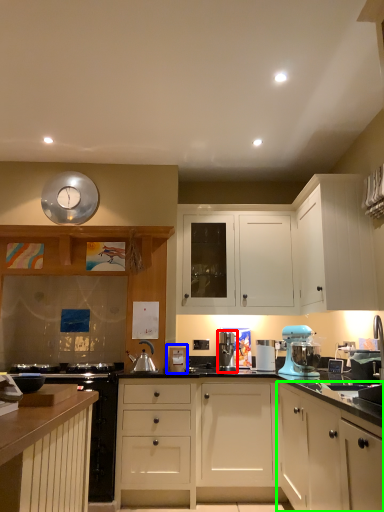
Question: Based on their relative distances, which object is nearer to kitchen appliance (highlighted by a red box)? Choose from appliance (highlighted by a blue box) and cabinetry (highlighted by a green box).

Choices:
 (A) appliance
 (B) cabinetry

Answer: (A)